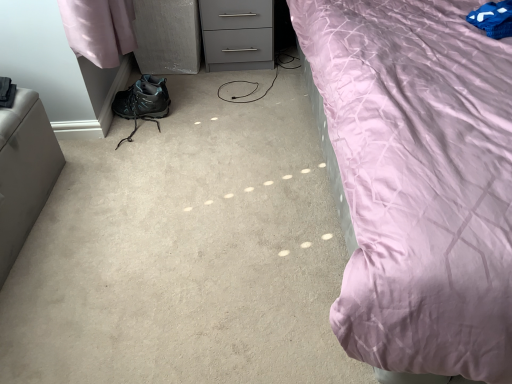
The height and width of the screenshot is (384, 512). What do you see at coordinates (143, 100) in the screenshot? I see `matte black hiking boot at lower left` at bounding box center [143, 100].

What are the coordinates of `satin gray ottoman at left` in the screenshot? It's located at (24, 172).

The image size is (512, 384). Describe the element at coordinates (419, 180) in the screenshot. I see `matte pink fabric at upper right` at that location.

At what (x,y) coordinates should I click in order to perform the action: click on matte black boot at lower left. Please return your answer as a coordinate pair (x, y). Looking at the image, I should click on (142, 102).

Which object is positioned more to the right, matte black hiking boot at lower left or satin gray ottoman at left?

matte black hiking boot at lower left.

Is matte black hiking boot at lower left turned away from satin gray ottoman at left?

That's not correct — matte black hiking boot at lower left is not looking away from satin gray ottoman at left.

Considering the sizes of matte black hiking boot at lower left and satin gray ottoman at left in the image, is matte black hiking boot at lower left bigger or smaller than satin gray ottoman at left?

matte black hiking boot at lower left is smaller than satin gray ottoman at left.

From the image's perspective, is matte black hiking boot at lower left above satin gray ottoman at left?

Correct, matte black hiking boot at lower left appears higher than satin gray ottoman at left in the image.

Is matte black boot at lower left inside matte black hiking boot at lower left?

Actually, matte black boot at lower left is outside matte black hiking boot at lower left.

Does matte black hiking boot at lower left appear on the left side of matte black boot at lower left?

Yes.

Is matte black hiking boot at lower left turned away from matte black boot at lower left?

No, matte black hiking boot at lower left is not facing the opposite direction of matte black boot at lower left.

Which is more to the left, blue fabric pillow at upper right or satin gray ottoman at left?

satin gray ottoman at left.

Which object is further away from the camera, blue fabric pillow at upper right or satin gray ottoman at left?

blue fabric pillow at upper right is more distant.

Consider the image. Which object is wider, blue fabric pillow at upper right or satin gray ottoman at left?

blue fabric pillow at upper right.

In the scene shown: Who is shorter, blue fabric pillow at upper right or satin gray ottoman at left?

With less height is blue fabric pillow at upper right.

Is point (490, 7) closer or farther from the camera than point (228, 54)?

Clearly, point (490, 7) is closer to the camera than point (228, 54).

Is blue fabric pillow at upper right facing away from gray matte chest of drawers at upper center?

That's not correct — blue fabric pillow at upper right is not looking away from gray matte chest of drawers at upper center.

Considering the sizes of objects blue fabric pillow at upper right and gray matte chest of drawers at upper center in the image provided, who is smaller, blue fabric pillow at upper right or gray matte chest of drawers at upper center?

With smaller size is blue fabric pillow at upper right.

How different are the orientations of blue fabric pillow at upper right and gray matte chest of drawers at upper center in degrees?

The facing directions of blue fabric pillow at upper right and gray matte chest of drawers at upper center are 0.974 degrees apart.

Is blue fabric pillow at upper right oriented away from matte black boot at lower left?

That's not correct — blue fabric pillow at upper right is not looking away from matte black boot at lower left.

From a real-world perspective, is blue fabric pillow at upper right under matte black boot at lower left?

Actually, blue fabric pillow at upper right is physically above matte black boot at lower left in the real world.

Considering the relative positions of blue fabric pillow at upper right and matte black boot at lower left in the image provided, is blue fabric pillow at upper right to the left of matte black boot at lower left from the viewer's perspective?

In fact, blue fabric pillow at upper right is to the right of matte black boot at lower left.

Is the surface of matte pink fabric at upper right in direct contact with matte black hiking boot at lower left?

They are not placed beside each other.

I want to click on bed in front of the matte black hiking boot at lower left, so click(419, 180).

Is matte pink fabric at upper right looking in the opposite direction of matte black hiking boot at lower left?

That's not correct — matte pink fabric at upper right is not looking away from matte black hiking boot at lower left.

Is matte pink fabric at upper right positioned beyond the bounds of matte black hiking boot at lower left?

matte pink fabric at upper right lies outside matte black hiking boot at lower left's area.

From the image's perspective, which one is positioned higher, matte black boot at lower left or gray matte chest of drawers at upper center?

gray matte chest of drawers at upper center appears higher in the image.

Is matte black boot at lower left next to gray matte chest of drawers at upper center?

No.

Considering the sizes of objects matte black boot at lower left and gray matte chest of drawers at upper center in the image provided, who is taller, matte black boot at lower left or gray matte chest of drawers at upper center?

gray matte chest of drawers at upper center.

Can you confirm if matte black boot at lower left is positioned to the right of gray matte chest of drawers at upper center?

No.

I want to click on furniture below the matte black hiking boot at lower left (from the image's perspective), so 24,172.

There is a matte black boot at lower left. Where is `shoe above it (from a real-world perspective)`? Image resolution: width=512 pixels, height=384 pixels. shoe above it (from a real-world perspective) is located at coordinates (143, 100).

Estimate the real-world distances between objects in this image. Which object is closer to blue fabric pillow at upper right, matte black hiking boot at lower left or satin gray ottoman at left?

matte black hiking boot at lower left is closer to blue fabric pillow at upper right.

Considering their positions, is satin gray ottoman at left positioned further to blue fabric pillow at upper right than matte black boot at lower left?

Based on the image, satin gray ottoman at left appears to be further to blue fabric pillow at upper right.

Looking at the image, which one is located further to blue fabric pillow at upper right, matte black hiking boot at lower left or gray matte chest of drawers at upper center?

matte black hiking boot at lower left lies further to blue fabric pillow at upper right than the other object.

Estimate the real-world distances between objects in this image. Which object is further from matte black boot at lower left, matte pink fabric at upper right or blue fabric pillow at upper right?

The object further to matte black boot at lower left is blue fabric pillow at upper right.

Based on their spatial positions, is blue fabric pillow at upper right or satin gray ottoman at left closer to gray matte chest of drawers at upper center?

satin gray ottoman at left lies closer to gray matte chest of drawers at upper center than the other object.

Based on their spatial positions, is satin gray ottoman at left or blue fabric pillow at upper right further from matte pink fabric at upper right?

satin gray ottoman at left is positioned further to the anchor matte pink fabric at upper right.

Considering their positions, is blue fabric pillow at upper right positioned further to matte pink fabric at upper right than matte black hiking boot at lower left?

matte black hiking boot at lower left is further to matte pink fabric at upper right.

Looking at the image, which one is located further to matte black hiking boot at lower left, satin gray ottoman at left or matte black boot at lower left?

Based on the image, satin gray ottoman at left appears to be further to matte black hiking boot at lower left.

Identify the location of the chest of drawers located between matte black boot at lower left and blue fabric pillow at upper right in the left-right direction. The width and height of the screenshot is (512, 384). (237, 34).

Where is `shoe positioned between matte pink fabric at upper right and gray matte chest of drawers at upper center from near to far`? This screenshot has height=384, width=512. shoe positioned between matte pink fabric at upper right and gray matte chest of drawers at upper center from near to far is located at coordinates (143, 100).

Find the location of a particular element. footwear positioned between matte pink fabric at upper right and matte black hiking boot at lower left from near to far is located at coordinates (142, 102).

Where is `pillow located between matte pink fabric at upper right and gray matte chest of drawers at upper center in the depth direction`? This screenshot has height=384, width=512. pillow located between matte pink fabric at upper right and gray matte chest of drawers at upper center in the depth direction is located at coordinates (493, 19).